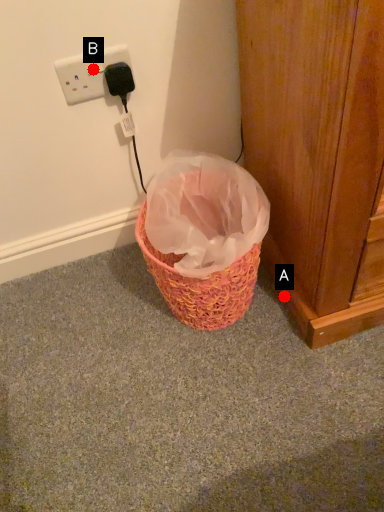
Question: Two points are circled on the image, labeled by A and B beside each circle. Which of the following is the farthest from the observer?

Choices:
 (A) A is further
 (B) B is further

Answer: (A)